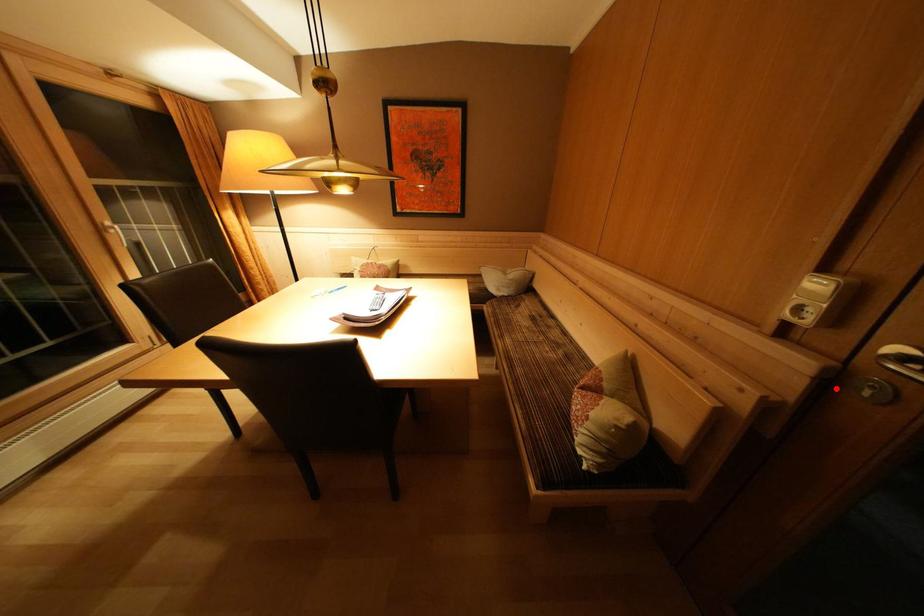
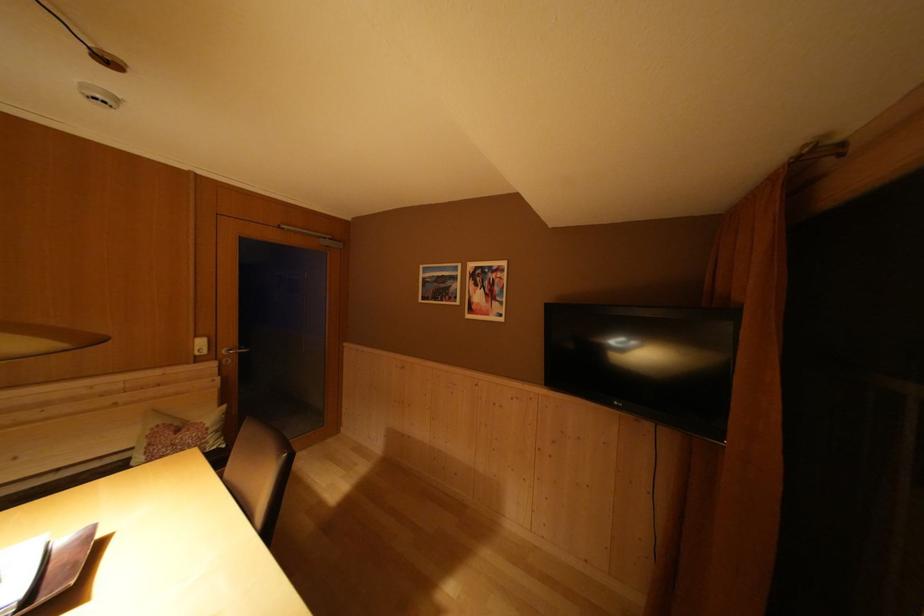
Where in the second image is the point corresponding to the highlighted location from the first image?

(226, 371)